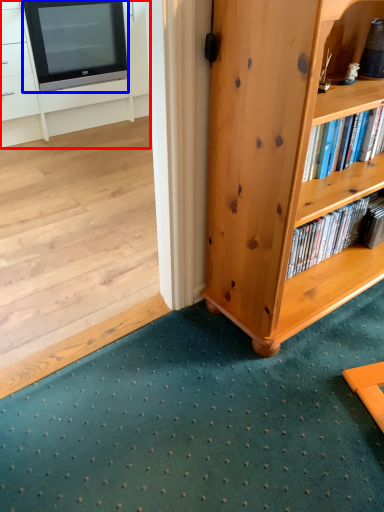
Question: Which of the following is the closest to the observer, cabinetry (highlighted by a red box) or television (highlighted by a blue box)?

Choices:
 (A) cabinetry
 (B) television

Answer: (A)